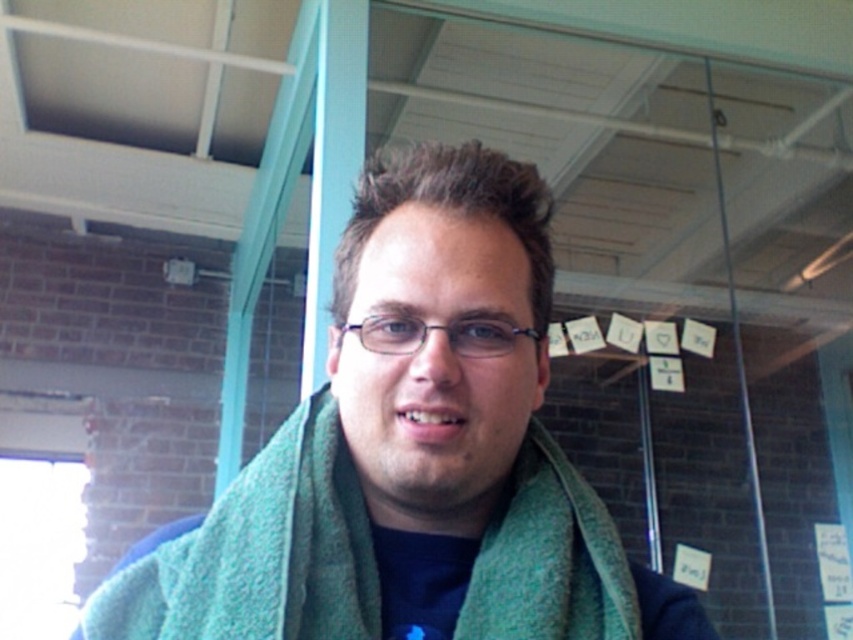
Question: Is green wool scarf at center positioned before green woolen scarf at center?

Choices:
 (A) no
 (B) yes

Answer: (B)

Question: Does green wool scarf at center have a smaller size compared to green woolen scarf at center?

Choices:
 (A) no
 (B) yes

Answer: (A)

Question: Which point is closer to the camera taking this photo?

Choices:
 (A) (352, 268)
 (B) (363, 538)

Answer: (A)

Question: Among these objects, which one is nearest to the camera?

Choices:
 (A) green wool scarf at center
 (B) green woolen scarf at center

Answer: (A)

Question: Where is green wool scarf at center located in relation to green woolen scarf at center in the image?

Choices:
 (A) above
 (B) below

Answer: (B)

Question: Which object is closer to the camera taking this photo?

Choices:
 (A) green woolen scarf at center
 (B) green wool scarf at center

Answer: (B)